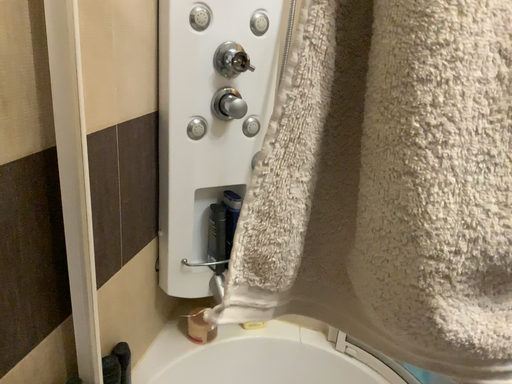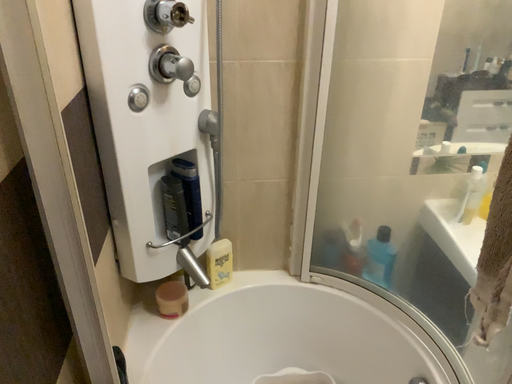
Question: How did the camera likely rotate when shooting the video?

Choices:
 (A) rotated downward
 (B) rotated upward

Answer: (A)